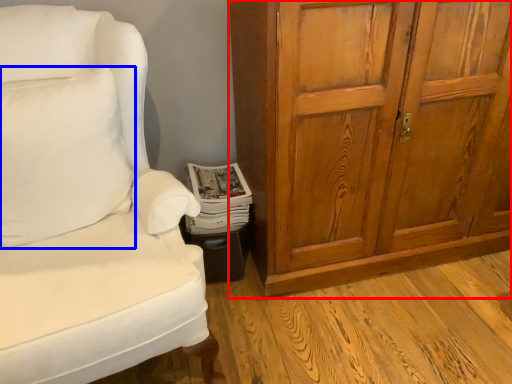
Question: Which object appears closest to the camera in this image, cabinetry (highlighted by a red box) or pillow (highlighted by a blue box)?

Choices:
 (A) cabinetry
 (B) pillow

Answer: (B)